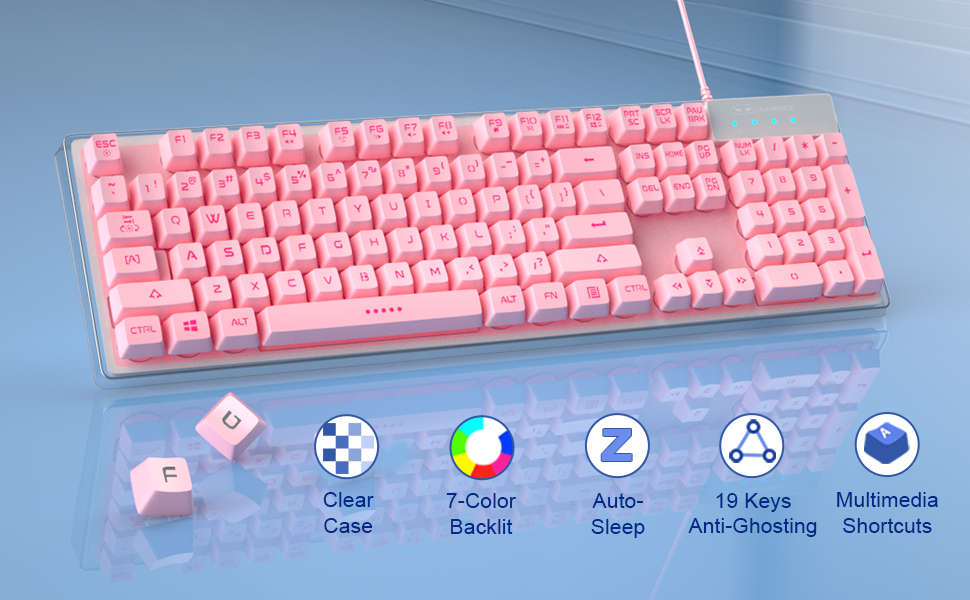
The width and height of the screenshot is (970, 600). Identify the location of reflection of the keyboard. (555, 411).